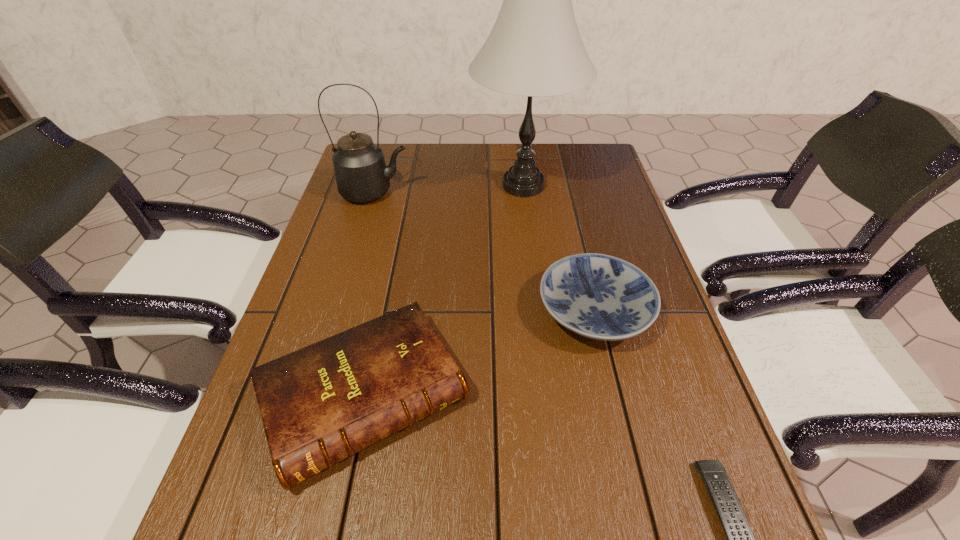
Where is `free space that satisfies the following two spatial constraints: 1. spout on the kettle; 2. on the right side of the plate`? The height and width of the screenshot is (540, 960). free space that satisfies the following two spatial constraints: 1. spout on the kettle; 2. on the right side of the plate is located at coordinates (341, 311).

I want to click on vacant region that satisfies the following two spatial constraints: 1. spout on the plate; 2. on the left side of the fourth shortest object, so click(x=341, y=311).

At what (x,y) coordinates should I click in order to perform the action: click on vacant point that satisfies the following two spatial constraints: 1. spout on the plate; 2. on the right side of the kettle. Please return your answer as a coordinate pair (x, y). This screenshot has height=540, width=960. Looking at the image, I should click on (341, 311).

At what (x,y) coordinates should I click in order to perform the action: click on vacant region that satisfies the following two spatial constraints: 1. on the back side of the hardback book; 2. spout on the fourth shortest object. Please return your answer as a coordinate pair (x, y). This screenshot has height=540, width=960. Looking at the image, I should click on (406, 193).